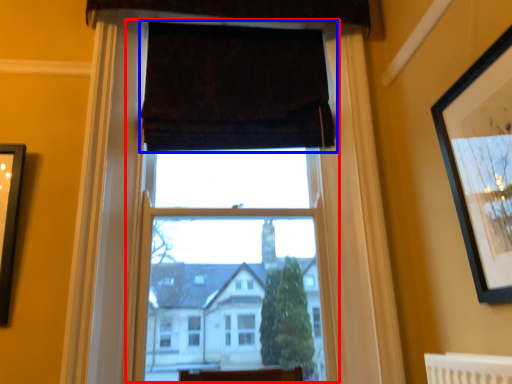
Question: Which object appears farthest to the camera in this image, window frame (highlighted by a red box) or curtain (highlighted by a blue box)?

Choices:
 (A) window frame
 (B) curtain

Answer: (B)